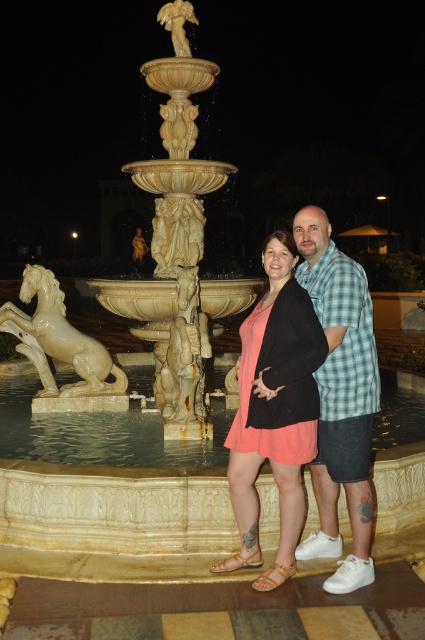
Question: Among these objects, which one is farthest from the camera?

Choices:
 (A) white glossy horse at left
 (B) gold marble statue at upper center

Answer: (B)

Question: Which point appears farthest from the camera in this image?

Choices:
 (A) (115, 390)
 (B) (232, 474)

Answer: (A)

Question: Among these objects, which one is farthest from the camera?

Choices:
 (A) white glossy horse at left
 (B) gold marble statue at upper center
 (C) checkered fabric shirt at center

Answer: (B)

Question: Is white glossy horse at left smaller than gold marble statue at upper center?

Choices:
 (A) no
 (B) yes

Answer: (A)

Question: Observing the image, what is the correct spatial positioning of checkered fabric shirt at center in reference to white glossy horse at left?

Choices:
 (A) above
 (B) below

Answer: (B)

Question: Can you confirm if matte coral dress at center is positioned to the right of white glossy horse at left?

Choices:
 (A) no
 (B) yes

Answer: (B)